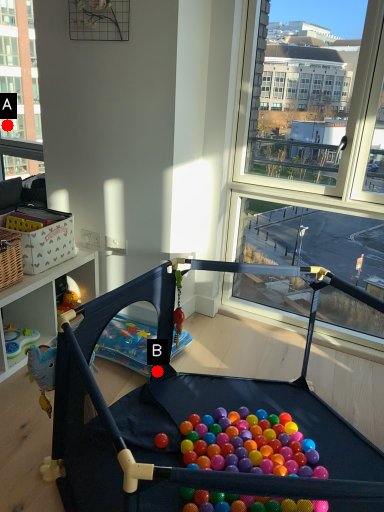
Question: Two points are circled on the image, labeled by A and B beside each circle. Among these points, which one is farthest from the camera?

Choices:
 (A) A is further
 (B) B is further

Answer: (A)